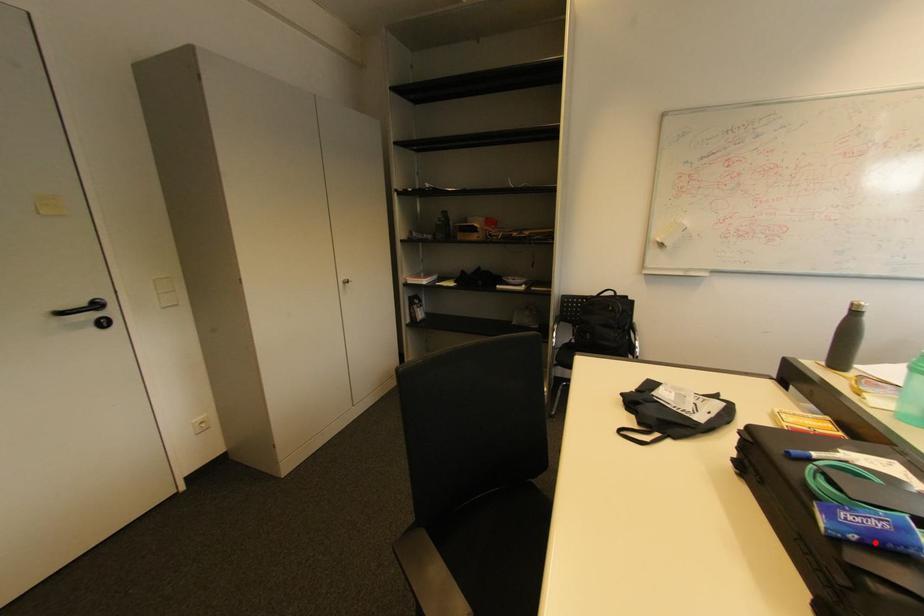
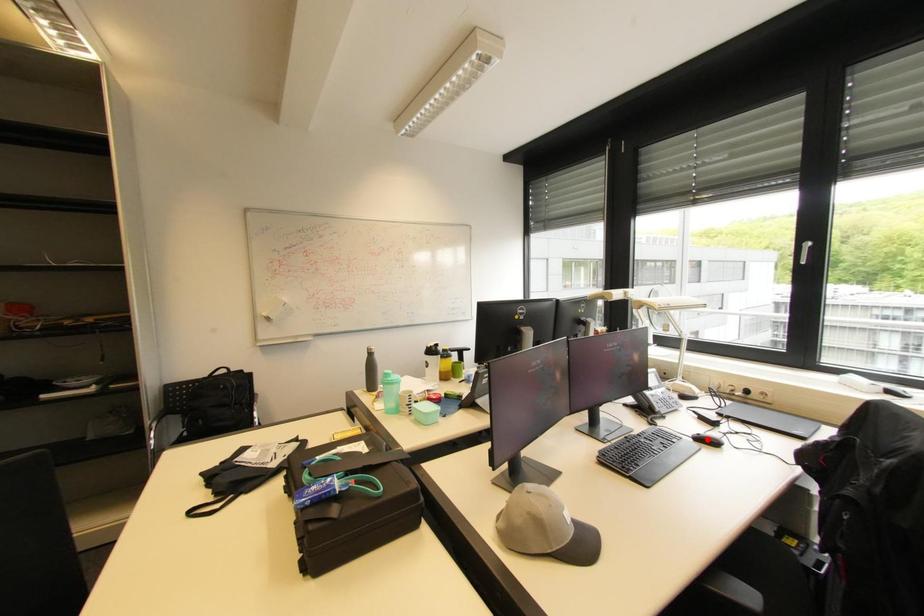
I am providing you with two images of the same scene from different viewpoints. A red point is marked on the first image and another point is marked on the second image. Do the highlighted points in image1 and image2 indicate the same real-world spot?

No